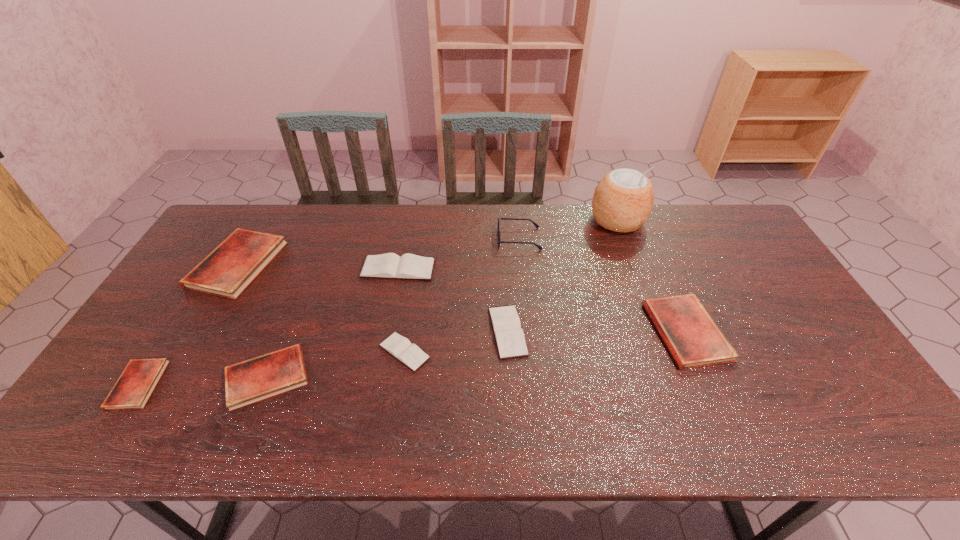
This screenshot has height=540, width=960. I want to click on vacant space located on the right of the third diary from left to right, so click(456, 377).

The height and width of the screenshot is (540, 960). What are the coordinates of `free space located 0.070m on the right of the smallest brown diary` in the screenshot? It's located at (458, 352).

Find the location of a particular element. The image size is (960, 540). free space located 0.200m on the back of the smallest red diary is located at coordinates (189, 303).

Locate an element on the screen. The width and height of the screenshot is (960, 540). coconut that is at the far edge is located at coordinates (x=622, y=202).

At what (x,y) coordinates should I click in order to perform the action: click on spectacles at the far edge. Please return your answer as a coordinate pair (x, y). Image resolution: width=960 pixels, height=540 pixels. Looking at the image, I should click on click(498, 232).

The height and width of the screenshot is (540, 960). Identify the location of diary located in the far edge section of the desktop. (230, 268).

Identify the location of object that is at the far left corner. This screenshot has height=540, width=960. (230, 268).

Where is `object that is at the near left corner`? object that is at the near left corner is located at coordinates (132, 390).

Locate an element on the screen. vacant space at the far edge of the desktop is located at coordinates (435, 217).

Find the location of a particular element. vacant space at the near edge is located at coordinates (337, 430).